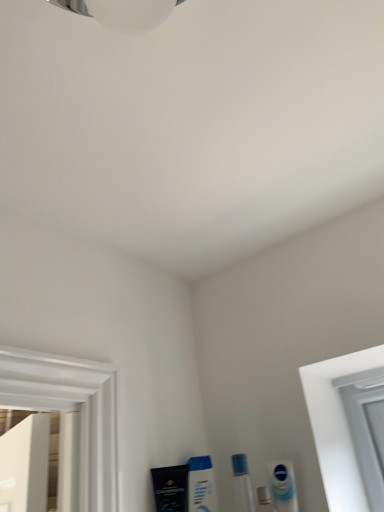
Question: Is white glossy mouthwash at lower center, the second mouthwash in the left-to-right sequence, to the right of black matte tube at lower left, positioned as the fourth mouthwash in right-to-left order, from the viewer's perspective?

Choices:
 (A) yes
 (B) no

Answer: (A)

Question: Does white glossy mouthwash at lower center, the third mouthwash viewed from the right, turn towards black matte tube at lower left, acting as the first mouthwash starting from the left?

Choices:
 (A) yes
 (B) no

Answer: (B)

Question: Is the depth of white glossy mouthwash at lower center, the third mouthwash viewed from the right, greater than that of black matte tube at lower left, acting as the first mouthwash starting from the left?

Choices:
 (A) yes
 (B) no

Answer: (A)

Question: Does white glossy mouthwash at lower center, the third mouthwash viewed from the right, touch black matte tube at lower left, acting as the first mouthwash starting from the left?

Choices:
 (A) yes
 (B) no

Answer: (A)

Question: Can you confirm if white glossy mouthwash at lower center, the second mouthwash in the left-to-right sequence, is smaller than black matte tube at lower left, positioned as the fourth mouthwash in right-to-left order?

Choices:
 (A) yes
 (B) no

Answer: (A)

Question: Is white glossy mouthwash at lower center, the third mouthwash viewed from the right, oriented away from black matte tube at lower left, positioned as the fourth mouthwash in right-to-left order?

Choices:
 (A) no
 (B) yes

Answer: (A)

Question: Is black matte tube at lower left, positioned as the fourth mouthwash in right-to-left order, oriented towards transparent plastic vial at lower center?

Choices:
 (A) no
 (B) yes

Answer: (A)

Question: Can you confirm if black matte tube at lower left, acting as the first mouthwash starting from the left, is smaller than transparent plastic vial at lower center?

Choices:
 (A) yes
 (B) no

Answer: (B)

Question: Considering the relative sizes of black matte tube at lower left, positioned as the fourth mouthwash in right-to-left order, and transparent plastic vial at lower center in the image provided, is black matte tube at lower left, positioned as the fourth mouthwash in right-to-left order, taller than transparent plastic vial at lower center?

Choices:
 (A) no
 (B) yes

Answer: (B)

Question: From a real-world perspective, is black matte tube at lower left, positioned as the fourth mouthwash in right-to-left order, under transparent plastic vial at lower center?

Choices:
 (A) yes
 (B) no

Answer: (B)

Question: Is black matte tube at lower left, positioned as the fourth mouthwash in right-to-left order, looking in the opposite direction of transparent plastic vial at lower center?

Choices:
 (A) no
 (B) yes

Answer: (A)

Question: Does black matte tube at lower left, positioned as the fourth mouthwash in right-to-left order, have a lesser width compared to transparent plastic vial at lower center?

Choices:
 (A) yes
 (B) no

Answer: (B)

Question: Considering the relative sizes of white glossy tube at lower right, which is the first mouthwash in right-to-left order, and black matte tube at lower left, acting as the first mouthwash starting from the left, in the image provided, is white glossy tube at lower right, which is the first mouthwash in right-to-left order, thinner than black matte tube at lower left, acting as the first mouthwash starting from the left,?

Choices:
 (A) no
 (B) yes

Answer: (B)